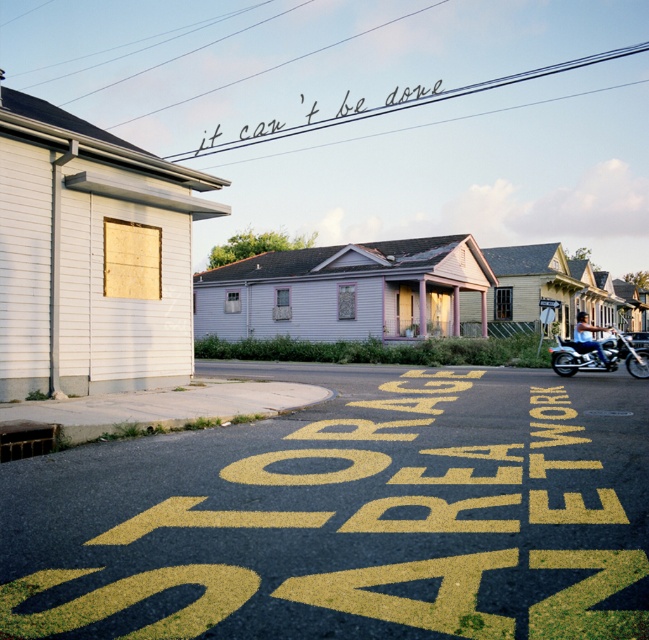
You are standing on the residential street and see the shiny chrome motorcycle at right. Where exactly is it located in terms of coordinates?

The shiny chrome motorcycle at right is located at point (598,356).

You are a delivery driver trying to find the address of a client. You arrive at this street and see the yellow asphalt at center and the black ink writing at upper center. Which of these two landmarks is larger in size?

The black ink writing at upper center is larger than the yellow asphalt at center because the yellow asphalt at center occupies less space than black ink writing at upper center.